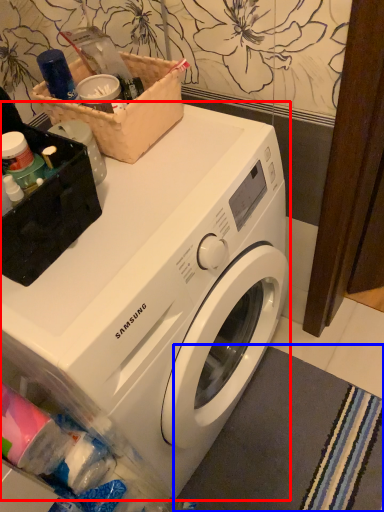
Question: Which object is further to the camera taking this photo, washing machine (highlighted by a red box) or bath mat (highlighted by a blue box)?

Choices:
 (A) washing machine
 (B) bath mat

Answer: (B)